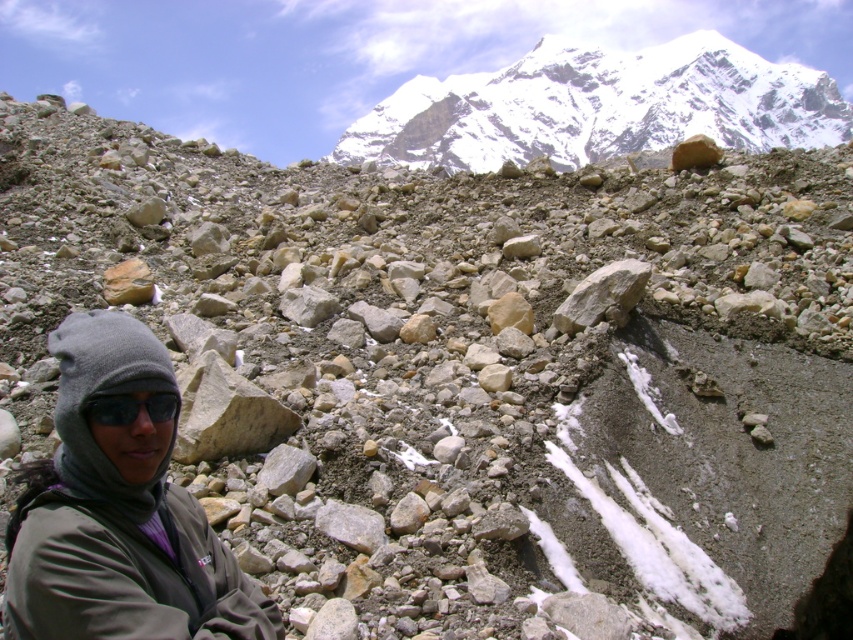
Which is in front, point (177, 556) or point (171, 412)?

Point (177, 556) is more forward.

Looking at this image, is gray fleece jacket at lower left below black matte goggles at lower left?

Indeed, gray fleece jacket at lower left is positioned under black matte goggles at lower left.

Describe the element at coordinates (119, 513) in the screenshot. The image size is (853, 640). I see `gray fleece jacket at lower left` at that location.

This screenshot has height=640, width=853. I want to click on gray fleece jacket at lower left, so click(x=119, y=513).

Is the position of snowy granite peak at upper center less distant than that of black matte goggles at lower left?

No, it is not.

Who is more forward, (384, 157) or (120, 419)?

Point (120, 419) is in front.

Is point (703, 83) positioned in front of point (155, 417)?

No, (703, 83) is behind (155, 417).

You are a GUI agent. You are given a task and a screenshot of the screen. Output one action in this format:
    pyautogui.click(x=<x>, y=<y>)
    Task: Click on the snowy granite peak at upper center
    
    Given the screenshot: What is the action you would take?
    pyautogui.click(x=599, y=106)

Does gray fleece jacket at lower left have a greater height compared to snowy granite peak at upper center?

Incorrect, gray fleece jacket at lower left's height is not larger of snowy granite peak at upper center's.

Between gray fleece jacket at lower left and snowy granite peak at upper center, which one appears on the left side from the viewer's perspective?

gray fleece jacket at lower left is more to the left.

This screenshot has height=640, width=853. What do you see at coordinates (119, 513) in the screenshot?
I see `gray fleece jacket at lower left` at bounding box center [119, 513].

At what (x,y) coordinates should I click in order to perform the action: click on gray fleece jacket at lower left. Please return your answer as a coordinate pair (x, y). The width and height of the screenshot is (853, 640). Looking at the image, I should click on (119, 513).